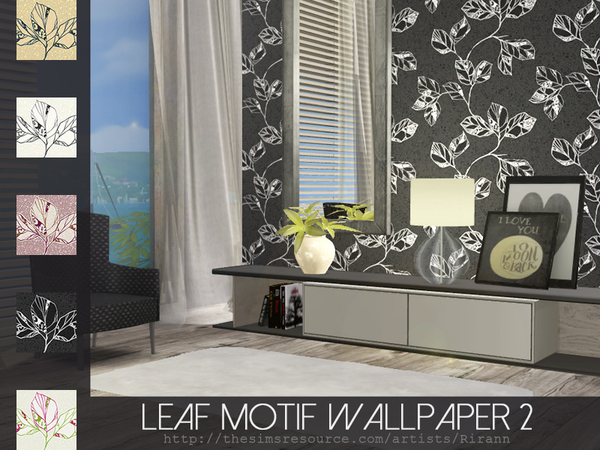
Where is `blinds`? This screenshot has height=450, width=600. blinds is located at coordinates (333, 96).